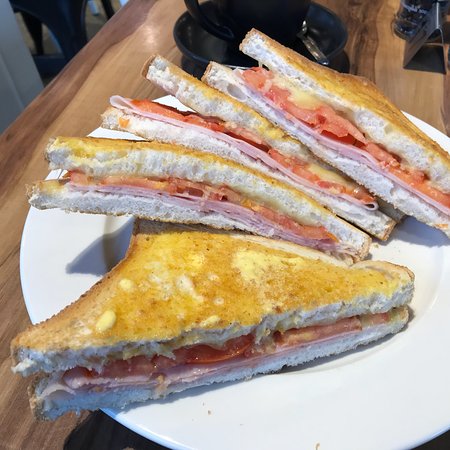
Locate an element on the screen. Image resolution: width=450 pixels, height=450 pixels. black saucer is located at coordinates (214, 46).